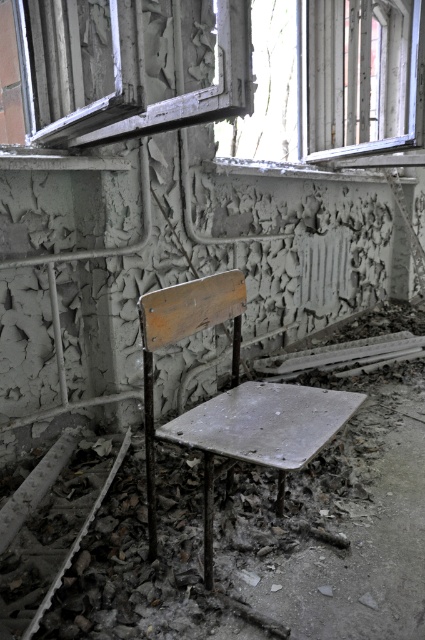
You are an inspector assessing the structural integrity of this abandoned building. You notice the transparent glass window at upper center and the white textured frame at upper left. Which object is taller?

The transparent glass window at upper center is taller than the white textured frame at upper left according to the description.